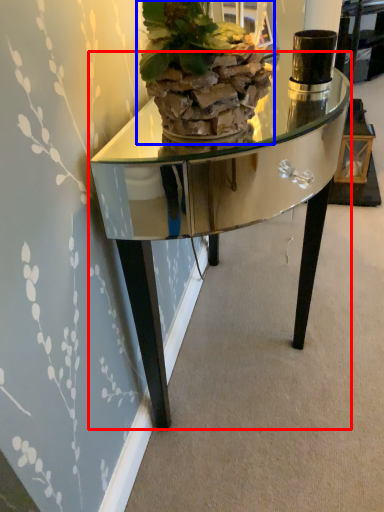
Question: Which object appears farthest to the camera in this image, table (highlighted by a red box) or houseplant (highlighted by a blue box)?

Choices:
 (A) table
 (B) houseplant

Answer: (A)